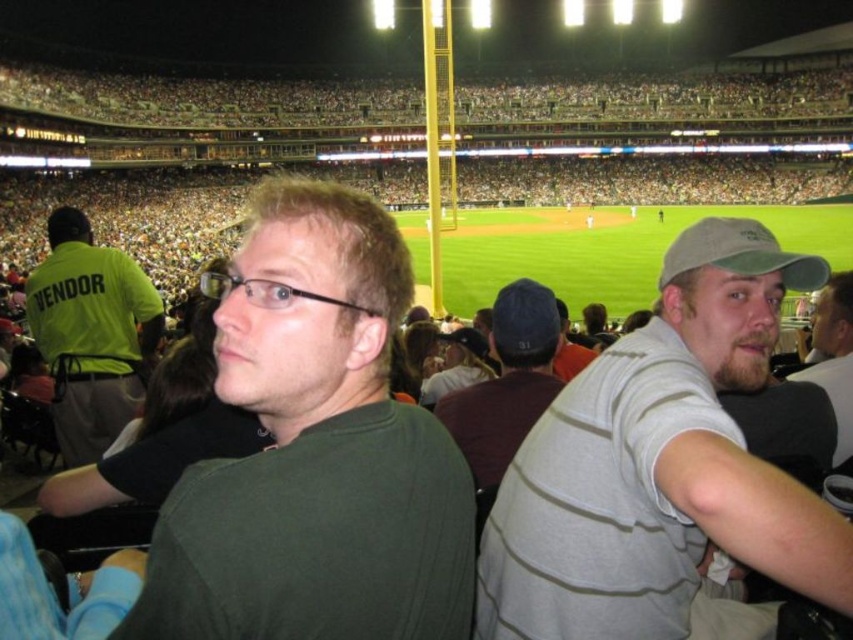
You are standing at the center of the baseball stadium field and want to locate the gray striped shirt at right. According to the coordinate system where the bottom left corner is 0,0 and the top right is 1,1, in which general direction should you look to find it?

The gray striped shirt at right is located at point (660, 465), which is in the upper right direction from the center of the field.

You are a photographer trying to capture a closeup of both the dark blue cap at center and the beige fabric cap at right. Which cap would require you to zoom in more to fill the frame?

The dark blue cap at center is thinner than the beige fabric cap at right, so you would need to zoom in more to fill the frame for the dark blue cap at center because it is smaller in size.